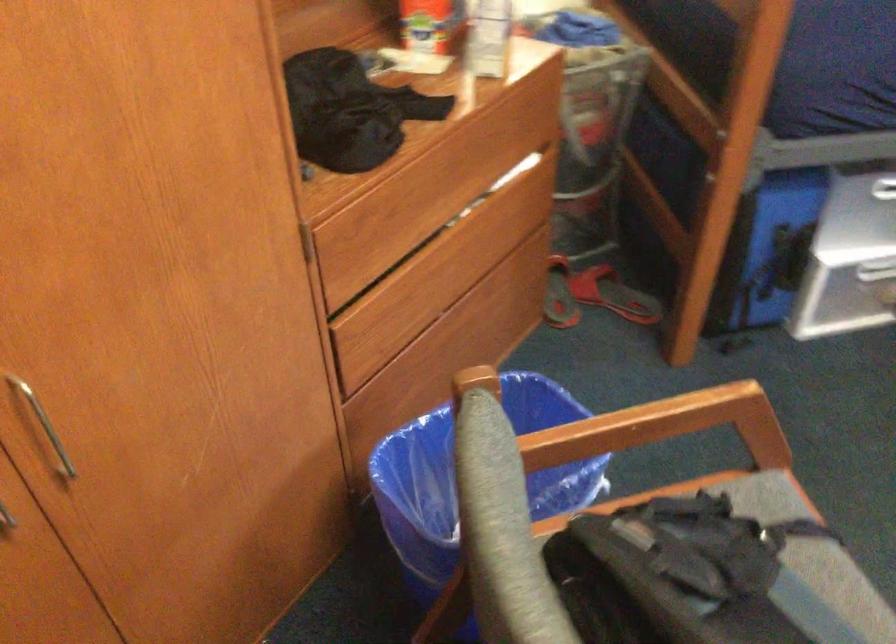
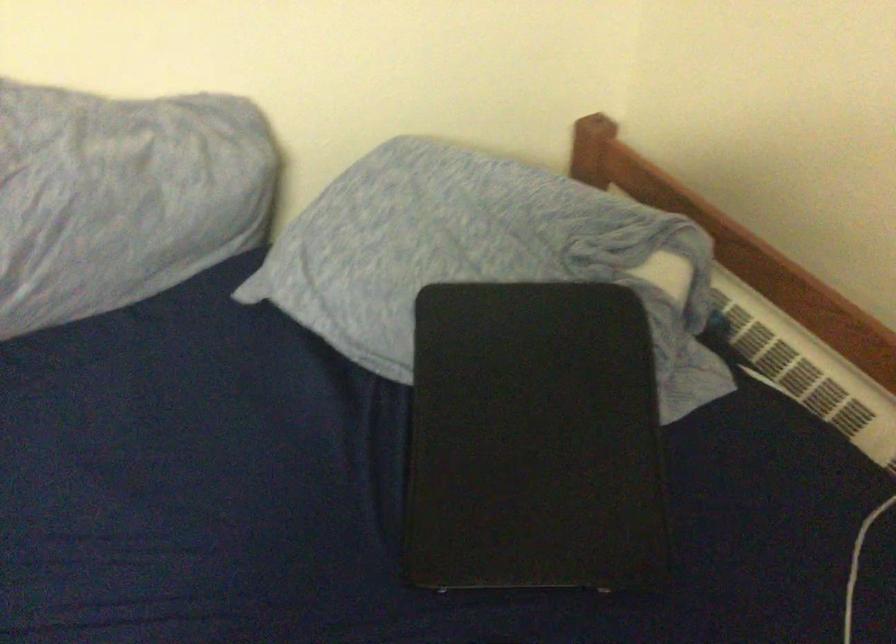
In a continuous first-person perspective shot, in which direction is the camera moving?

The cameraman moved toward right, forward.